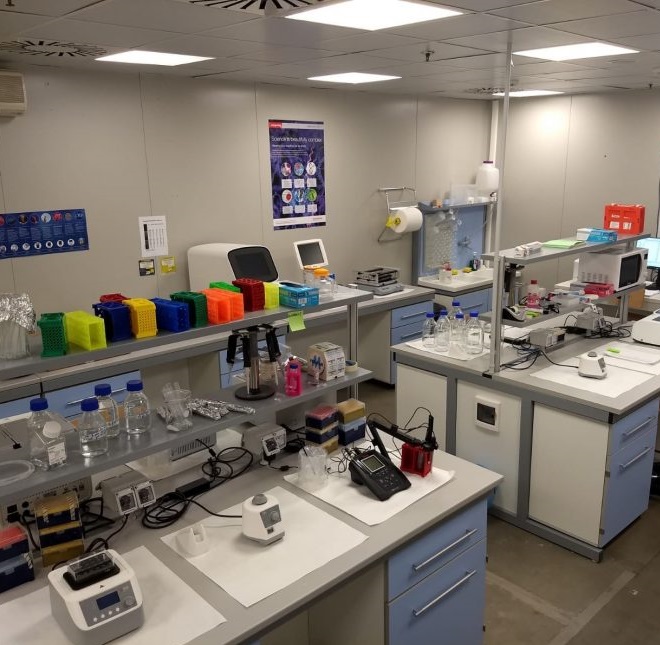
This screenshot has height=645, width=660. I want to click on sink, so (x=464, y=277).